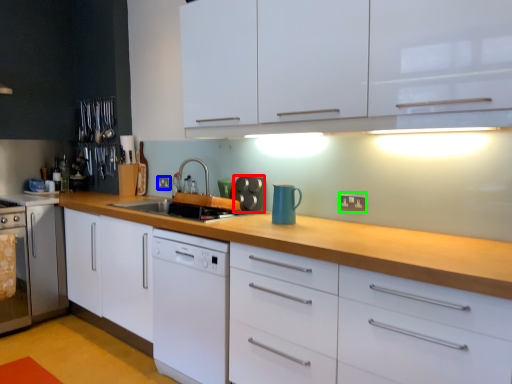
Question: Estimate the real-world distances between objects in this image. Which object is farther from appliance (highlighted by a red box), electric outlet (highlighted by a blue box) or electric outlet (highlighted by a green box)?

Choices:
 (A) electric outlet
 (B) electric outlet

Answer: (A)